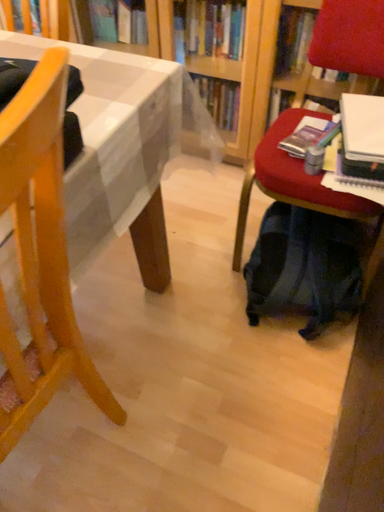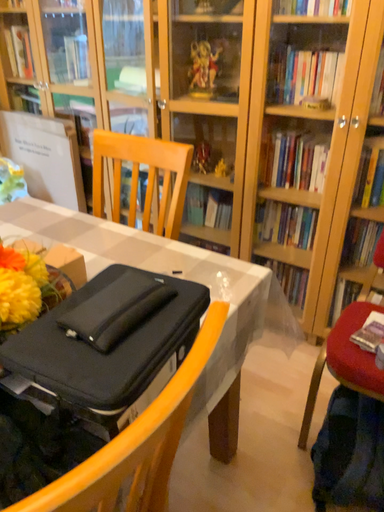
Question: Which way did the camera rotate in the video?

Choices:
 (A) rotated upward
 (B) rotated downward

Answer: (A)